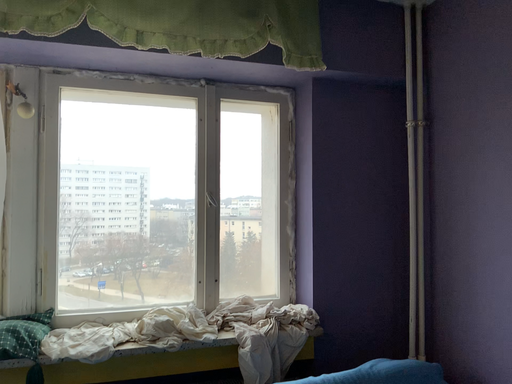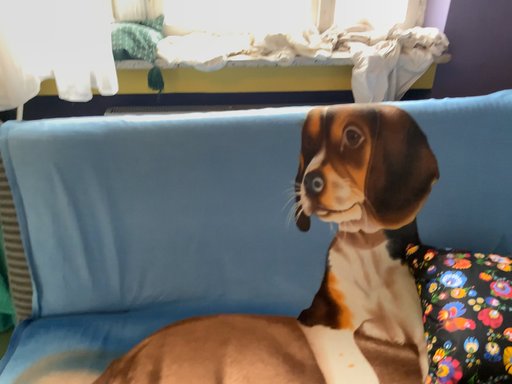
Question: Which way did the camera rotate in the video?

Choices:
 (A) rotated right
 (B) rotated left

Answer: (B)